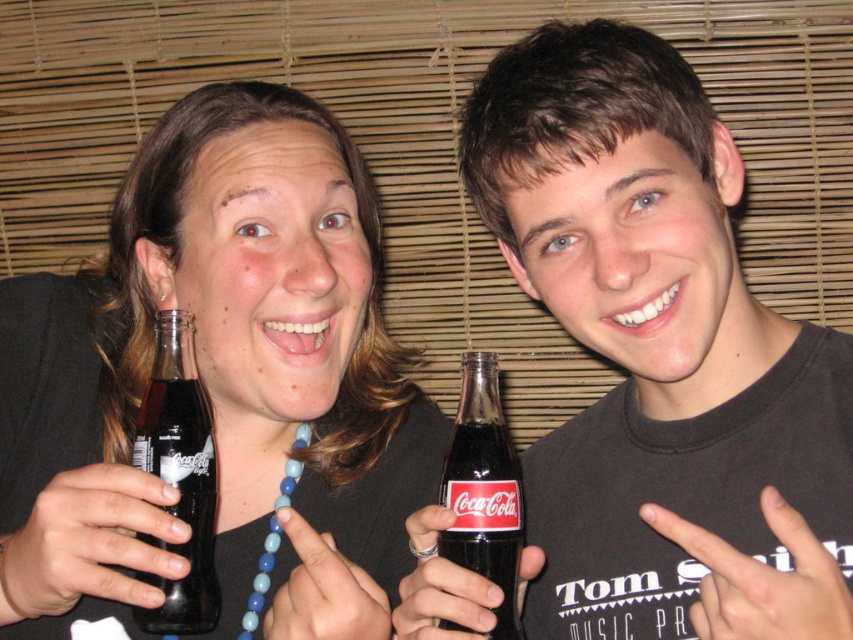
Which is behind, point (431, 492) or point (500, 524)?

Point (431, 492)

Which is above, translucent glass bottle at left or black glass coca-cola bottle at center?

translucent glass bottle at left is above.

Who is more forward, (309, 284) or (445, 484)?

Point (445, 484) is more forward.

The width and height of the screenshot is (853, 640). What are the coordinates of `translucent glass bottle at left` in the screenshot? It's located at (218, 385).

Which is below, black glass bottle at right or black glass coca-cola bottle at left?

Positioned lower is black glass coca-cola bottle at left.

Is black glass bottle at right closer to camera compared to black glass coca-cola bottle at left?

Yes, it is in front of black glass coca-cola bottle at left.

Where is `black glass bottle at right`? This screenshot has height=640, width=853. black glass bottle at right is located at coordinates (659, 356).

What are the coordinates of `black glass bottle at right` in the screenshot? It's located at (659, 356).

Who is more forward, (598, 68) or (86, 564)?

Point (86, 564) is in front.

Can you confirm if black glass bottle at right is smaller than translucent glass bottle at left?

Yes.

Where is `black glass bottle at right`? black glass bottle at right is located at coordinates (659, 356).

The height and width of the screenshot is (640, 853). Find the location of `black glass bottle at right`. black glass bottle at right is located at coordinates (659, 356).